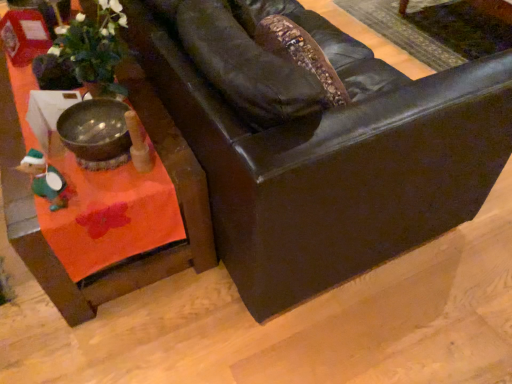
Question: Considering the positions of orange fabric table at lower left and matte black leather couch at center in the image, is orange fabric table at lower left bigger or smaller than matte black leather couch at center?

Choices:
 (A) big
 (B) small

Answer: (B)

Question: From a real-world perspective, is orange fabric table at lower left physically located above or below matte black leather couch at center?

Choices:
 (A) above
 (B) below

Answer: (B)

Question: Estimate the real-world distances between objects in this image. Which object is farther from the green felt toy at lower left?

Choices:
 (A) matte black leather couch at center
 (B) orange fabric table at lower left

Answer: (A)

Question: Estimate the real-world distances between objects in this image. Which object is farther from the matte black leather couch at center?

Choices:
 (A) orange fabric table at lower left
 (B) green felt toy at lower left

Answer: (B)